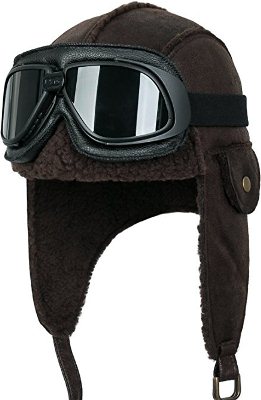
What are the coordinates of `smooth fabric material` in the screenshot? It's located at (247, 164), (234, 283), (145, 18), (211, 64).